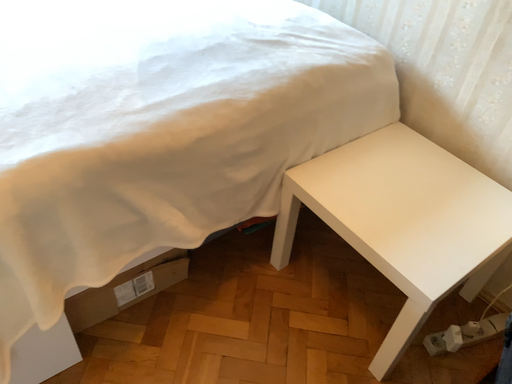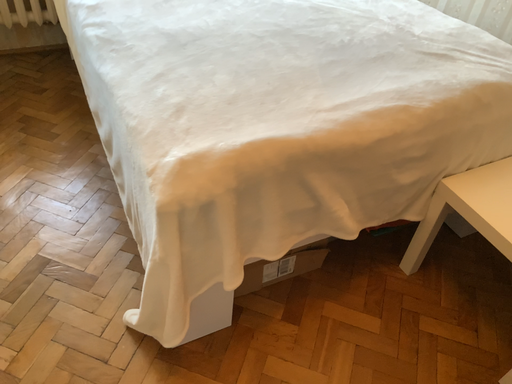
Question: How did the camera likely rotate when shooting the video?

Choices:
 (A) rotated left
 (B) rotated right

Answer: (A)